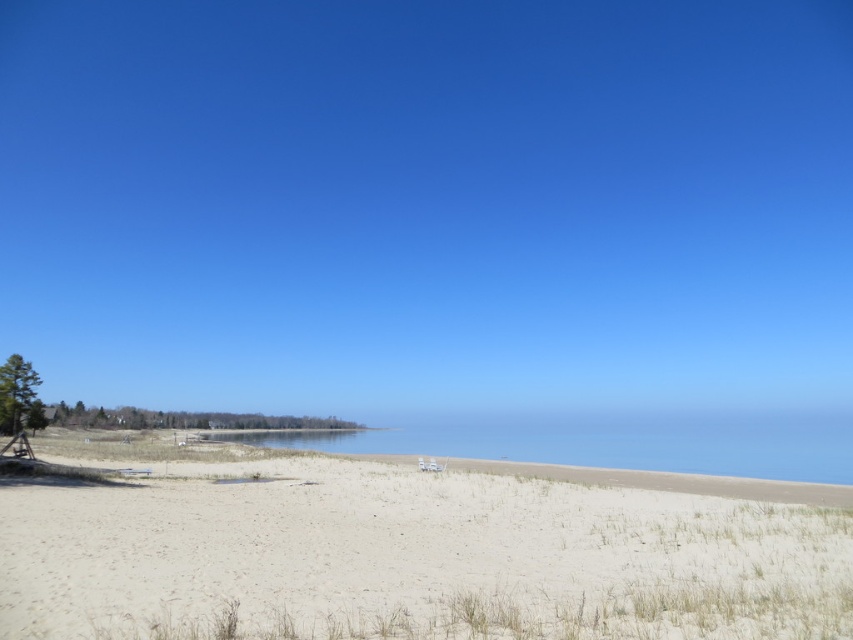
Question: Is white sandy beach at lower left bigger than blue water at center?

Choices:
 (A) no
 (B) yes

Answer: (A)

Question: Does white sandy beach at lower left have a larger size compared to blue water at center?

Choices:
 (A) no
 (B) yes

Answer: (A)

Question: In this image, where is white sandy beach at lower left located relative to blue water at center?

Choices:
 (A) right
 (B) left

Answer: (B)

Question: Which point appears closest to the camera in this image?

Choices:
 (A) (697, 468)
 (B) (520, 500)

Answer: (B)

Question: Among these points, which one is nearest to the camera?

Choices:
 (A) (535, 419)
 (B) (131, 512)

Answer: (B)